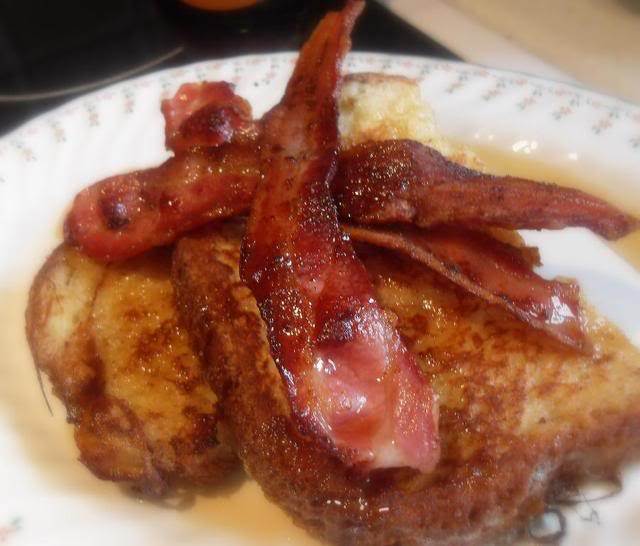
Locate an element on the screen. The image size is (640, 546). food on plate is located at coordinates (349, 284), (571, 432), (147, 355).